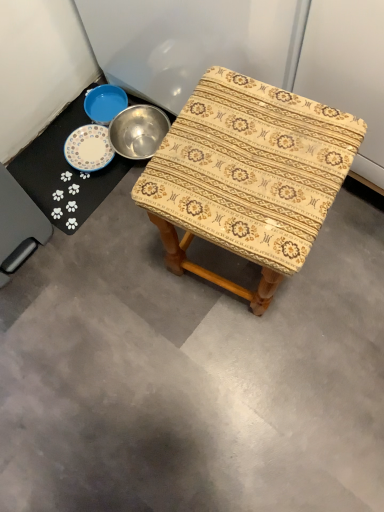
Question: From the image's perspective, is white glossy plate at upper left located above or below patterned fabric stool at center?

Choices:
 (A) above
 (B) below

Answer: (A)

Question: Is white glossy plate at upper left spatially inside patterned fabric stool at center, or outside of it?

Choices:
 (A) outside
 (B) inside

Answer: (A)

Question: Is white glossy plate at upper left to the left or to the right of patterned fabric stool at center in the image?

Choices:
 (A) right
 (B) left

Answer: (B)

Question: Considering the positions of point (192, 184) and point (21, 180), is point (192, 184) closer or farther from the camera than point (21, 180)?

Choices:
 (A) farther
 (B) closer

Answer: (B)

Question: From a real-world perspective, is patterned fabric stool at center positioned above or below white glossy plate at upper left?

Choices:
 (A) below
 (B) above

Answer: (B)

Question: Is patterned fabric stool at center taller or shorter than white glossy plate at upper left?

Choices:
 (A) tall
 (B) short

Answer: (A)

Question: Is patterned fabric stool at center to the left or to the right of white glossy plate at upper left in the image?

Choices:
 (A) right
 (B) left

Answer: (A)